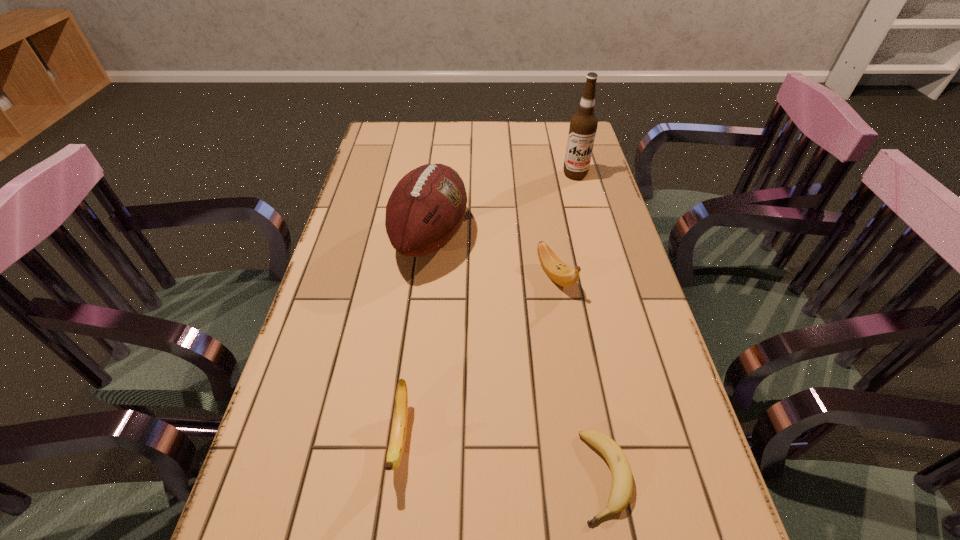
This screenshot has width=960, height=540. Identify the location of alcohol present at the right edge. click(583, 126).

The height and width of the screenshot is (540, 960). I want to click on blank area at the far edge, so click(447, 138).

Identify the location of vacant space at the left edge. Image resolution: width=960 pixels, height=540 pixels. (350, 437).

Image resolution: width=960 pixels, height=540 pixels. In the image, there is a desktop. What are the coordinates of `blank space at the right edge` in the screenshot? It's located at (559, 157).

Where is `unoccupied area between the shortest banana and the football (American)`? unoccupied area between the shortest banana and the football (American) is located at coordinates (517, 357).

Image resolution: width=960 pixels, height=540 pixels. Identify the location of vacant space in between the alcohol and the leftmost banana. (488, 307).

Locate an element on the screen. The image size is (960, 540). free point between the farthest banana and the rightmost object is located at coordinates (565, 225).

Where is `free space between the rightmost object and the farthest banana`? Image resolution: width=960 pixels, height=540 pixels. free space between the rightmost object and the farthest banana is located at coordinates (565, 225).

Where is `free space between the alcohol and the farthest banana`? The image size is (960, 540). free space between the alcohol and the farthest banana is located at coordinates (565, 225).

Find the location of a particular element. The image size is (960, 540). free point between the football (American) and the farthest banana is located at coordinates (493, 256).